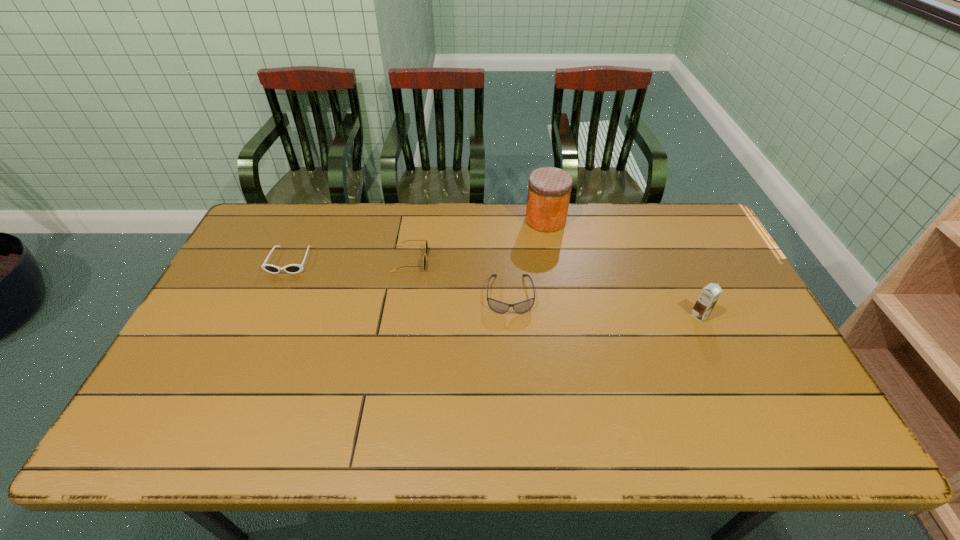
This screenshot has width=960, height=540. I want to click on vacant space located 0.120m on the lenses of the nearest sunglasses, so click(514, 350).

Locate an element on the screen. vacant space located on the front-facing side of the second object from left to right is located at coordinates (452, 260).

Identify the location of free region located with the lenses of the leftmost sunglasses facing outward. This screenshot has width=960, height=540. (269, 309).

You are a GUI agent. You are given a task and a screenshot of the screen. Output one action in this format:
    pyautogui.click(x=<x>, y=<y>)
    Task: Click on the object situated at the far edge
    
    Given the screenshot: What is the action you would take?
    pyautogui.click(x=549, y=190)

This screenshot has width=960, height=540. I want to click on object that is at the left edge, so click(x=292, y=268).

Locate an element on the screen. The image size is (960, 540). object that is at the right edge is located at coordinates (709, 295).

Where is `vacant space at the far edge of the desktop`? vacant space at the far edge of the desktop is located at coordinates (393, 241).

Image resolution: width=960 pixels, height=540 pixels. In the image, there is a desktop. Find the location of `free space at the left edge`. free space at the left edge is located at coordinates tap(266, 285).

The width and height of the screenshot is (960, 540). Find the location of `free spot at the right edge of the desktop`. free spot at the right edge of the desktop is located at coordinates (791, 387).

Locate an element on the screen. The image size is (960, 540). vacant point at the far left corner is located at coordinates (288, 243).